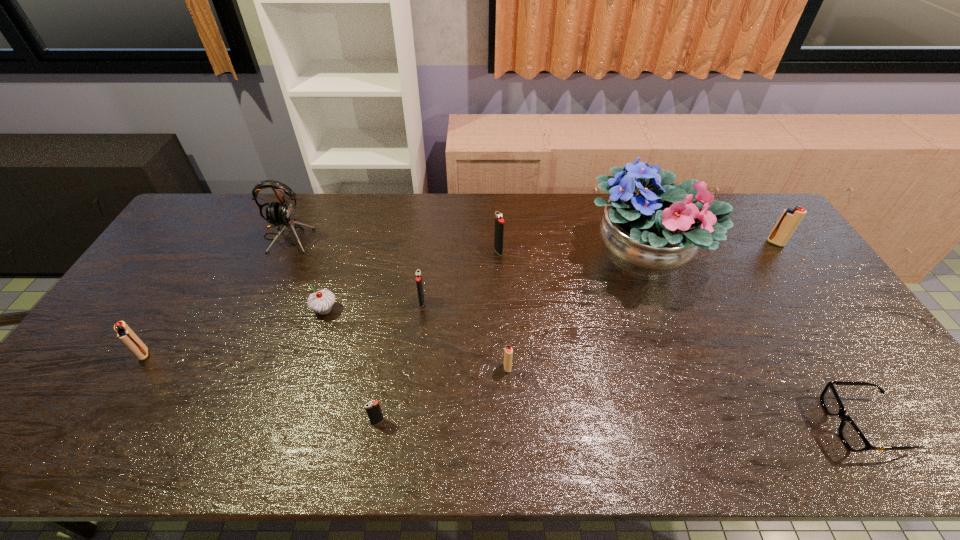
I want to click on vacant area situated 0.140m on the front-facing side of the sunglasses, so click(770, 424).

The width and height of the screenshot is (960, 540). What are the coordinates of `free region located 0.280m on the front-facing side of the sunglasses` in the screenshot? It's located at (709, 424).

Where is `bouquet located at the far edge`? bouquet located at the far edge is located at coordinates (649, 229).

Find the location of `earphone positioned at the far edge`. earphone positioned at the far edge is located at coordinates 282,213.

Identify the location of igniter that is positioned at the near edge. (373, 410).

I want to click on sunglasses present at the near edge, so click(x=850, y=434).

You are a GUI agent. You are given a task and a screenshot of the screen. Output one action in this format:
    pyautogui.click(x=<x>, y=<y>)
    Task: Click on the object that is positioned at the left edge
    Image resolution: width=960 pixels, height=540 pixels.
    Given the screenshot: What is the action you would take?
    pyautogui.click(x=124, y=333)

The height and width of the screenshot is (540, 960). What are the coordinates of `igniter that is at the right edge` in the screenshot? It's located at (790, 218).

You are a GUI agent. You are given a task and a screenshot of the screen. Output one action in this format:
    pyautogui.click(x=<x>, y=<y>)
    Task: Click on the sunglasses present at the right edge
    The width and height of the screenshot is (960, 540).
    Given the screenshot: What is the action you would take?
    pyautogui.click(x=850, y=434)

The width and height of the screenshot is (960, 540). I want to click on object situated at the near right corner, so click(x=850, y=434).